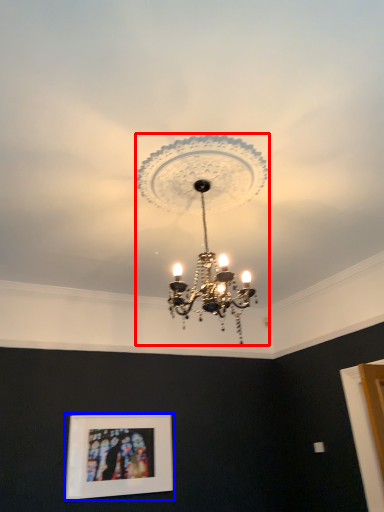
Question: Which point is further to the camera, lamp (highlighted by a red box) or picture frame (highlighted by a blue box)?

Choices:
 (A) lamp
 (B) picture frame

Answer: (B)